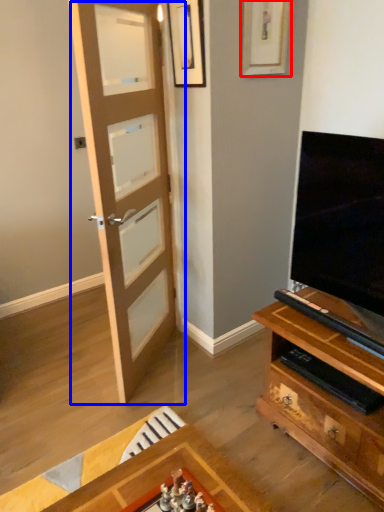
Question: Which object is closer to the camera taking this photo, picture frame (highlighted by a red box) or door (highlighted by a blue box)?

Choices:
 (A) picture frame
 (B) door

Answer: (B)